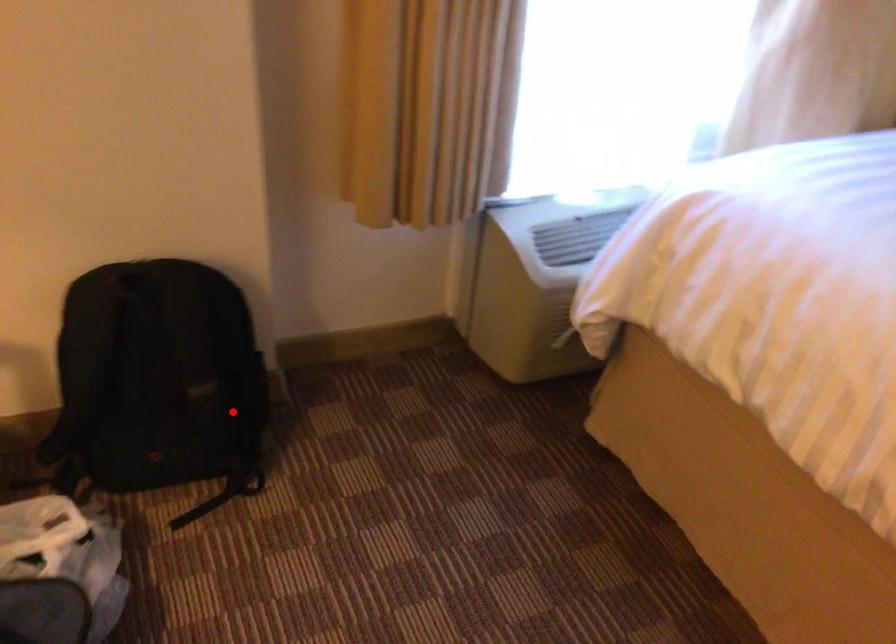
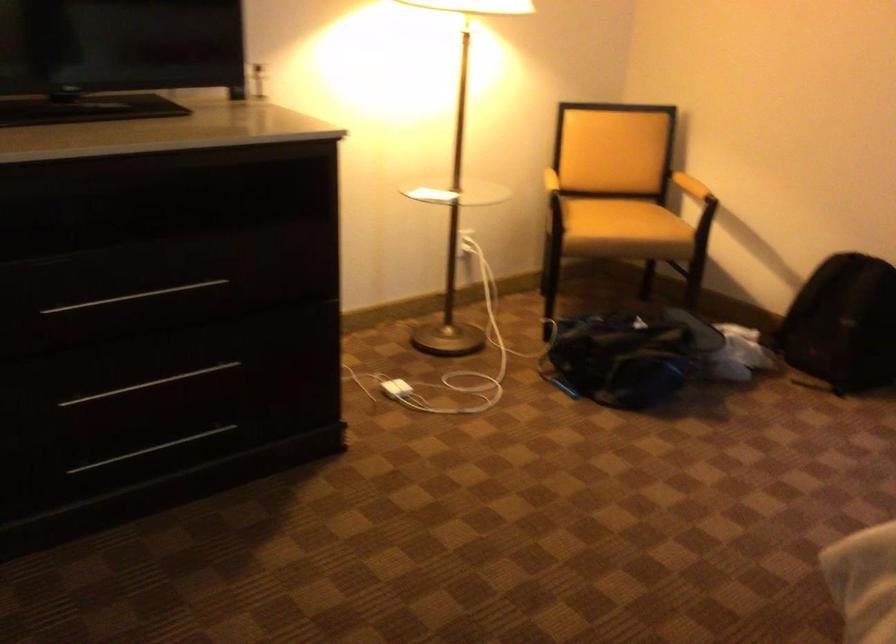
Locate, in the second image, the point that corresponds to the highlighted location in the first image.

(842, 324)